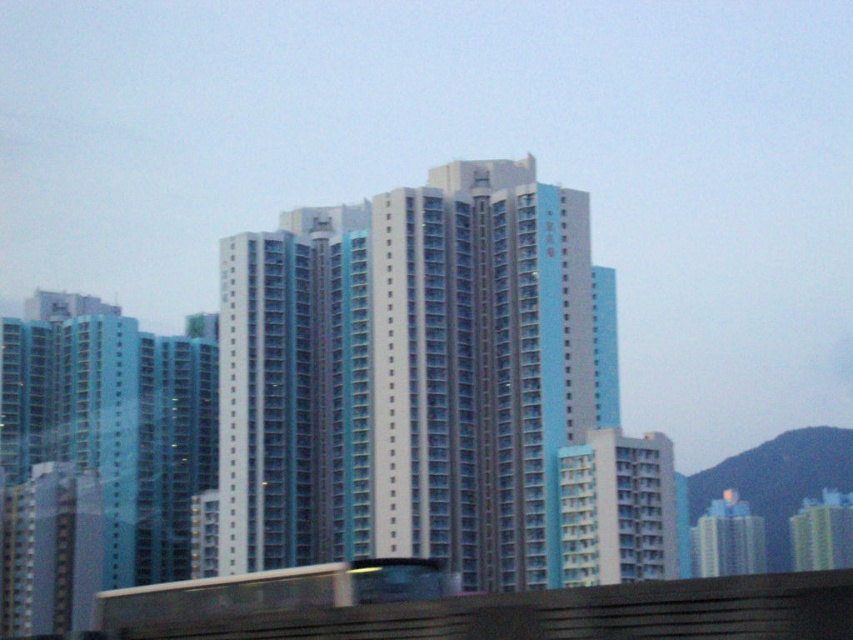
Measure the distance from white glass building at center to concrete platform at lower center.

white glass building at center and concrete platform at lower center are 232.05 feet apart from each other.

Does white glass building at center have a lesser width compared to concrete platform at lower center?

Incorrect, white glass building at center's width is not less than concrete platform at lower center's.

The image size is (853, 640). What do you see at coordinates (410, 376) in the screenshot?
I see `white glass building at center` at bounding box center [410, 376].

Where is `white glass building at center`? The image size is (853, 640). white glass building at center is located at coordinates (410, 376).